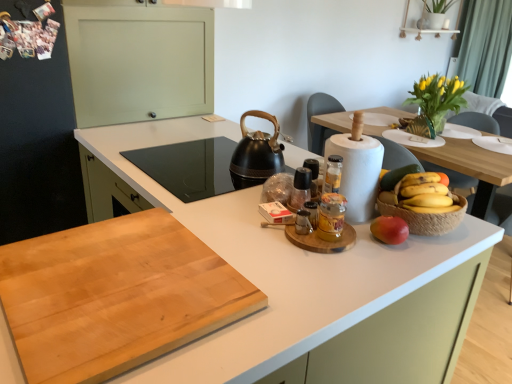
Question: Considering the relative sizes of translucent glass spice at center, the first bottle positioned from the back, and yellow matte bananas at right in the image provided, is translucent glass spice at center, the first bottle positioned from the back, thinner than yellow matte bananas at right?

Choices:
 (A) no
 (B) yes

Answer: (B)

Question: Does translucent glass spice at center, which is the second bottle in front-to-back order, have a greater height compared to yellow matte bananas at right?

Choices:
 (A) no
 (B) yes

Answer: (B)

Question: Is translucent glass spice at center, the first bottle positioned from the back, to the right of yellow matte bananas at right from the viewer's perspective?

Choices:
 (A) yes
 (B) no

Answer: (B)

Question: From the image's perspective, is translucent glass spice at center, the first bottle positioned from the back, below yellow matte bananas at right?

Choices:
 (A) no
 (B) yes

Answer: (B)

Question: From a real-world perspective, is translucent glass spice at center, which is the second bottle in front-to-back order, under yellow matte bananas at right?

Choices:
 (A) no
 (B) yes

Answer: (B)

Question: Is translucent glass spice at center, the first bottle positioned from the back, outside of yellow matte bananas at right?

Choices:
 (A) no
 (B) yes

Answer: (B)

Question: From a real-world perspective, is white matte countertop at center, the second countertop positioned from the top, positioned over red matte apple at right based on gravity?

Choices:
 (A) no
 (B) yes

Answer: (A)

Question: Is white matte countertop at center, the second countertop positioned from the top, facing towards red matte apple at right?

Choices:
 (A) no
 (B) yes

Answer: (A)

Question: Is white matte countertop at center, the second countertop positioned from the top, at the left side of red matte apple at right?

Choices:
 (A) no
 (B) yes

Answer: (B)

Question: Is white matte countertop at center, the second countertop positioned from the top, placed right next to red matte apple at right?

Choices:
 (A) yes
 (B) no

Answer: (B)

Question: From the image's perspective, does white matte countertop at center, acting as the first countertop starting from the bottom, appear lower than red matte apple at right?

Choices:
 (A) no
 (B) yes

Answer: (B)

Question: Is white matte countertop at center, the second countertop positioned from the top, oriented away from red matte apple at right?

Choices:
 (A) yes
 (B) no

Answer: (B)

Question: Does translucent glass jar at center, which is the 2th bottle from back to front, have a lesser width compared to green fabric curtain at upper right?

Choices:
 (A) yes
 (B) no

Answer: (A)